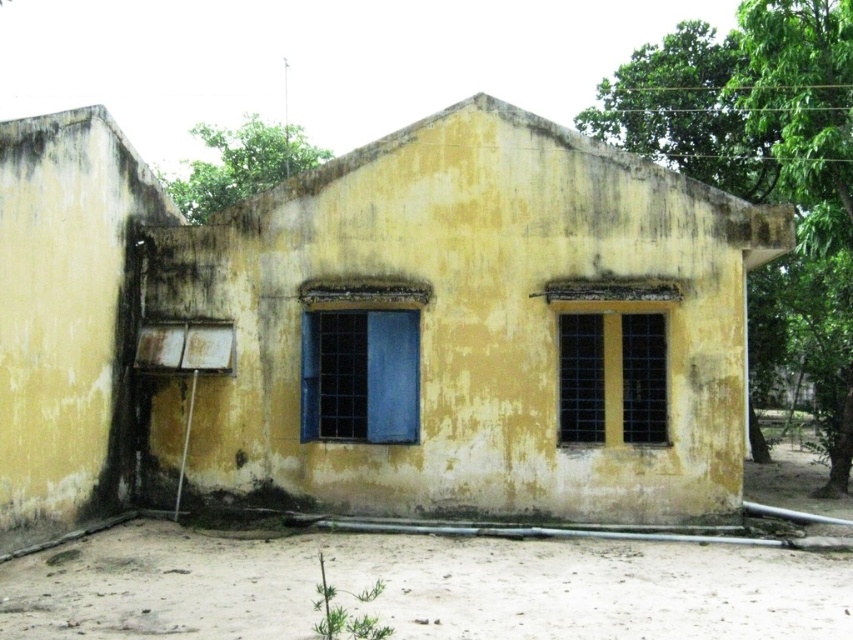
Question: Which object is the closest to the blue glass window at center?

Choices:
 (A) matte glass window at center right
 (B) brown sandy dirt field at lower center

Answer: (A)

Question: Can you confirm if yellow matte building at center is thinner than blue glass window at center?

Choices:
 (A) no
 (B) yes

Answer: (B)

Question: Is brown sandy dirt field at lower center to the left of matte glass window at center right from the viewer's perspective?

Choices:
 (A) yes
 (B) no

Answer: (A)

Question: Is yellow matte building at center thinner than blue glass window at center?

Choices:
 (A) yes
 (B) no

Answer: (A)

Question: Which point appears farthest from the camera in this image?

Choices:
 (A) (426, 472)
 (B) (302, 420)

Answer: (B)

Question: Which object is positioned closest to the blue glass window at center?

Choices:
 (A) yellow matte building at center
 (B) matte glass window at center right

Answer: (B)